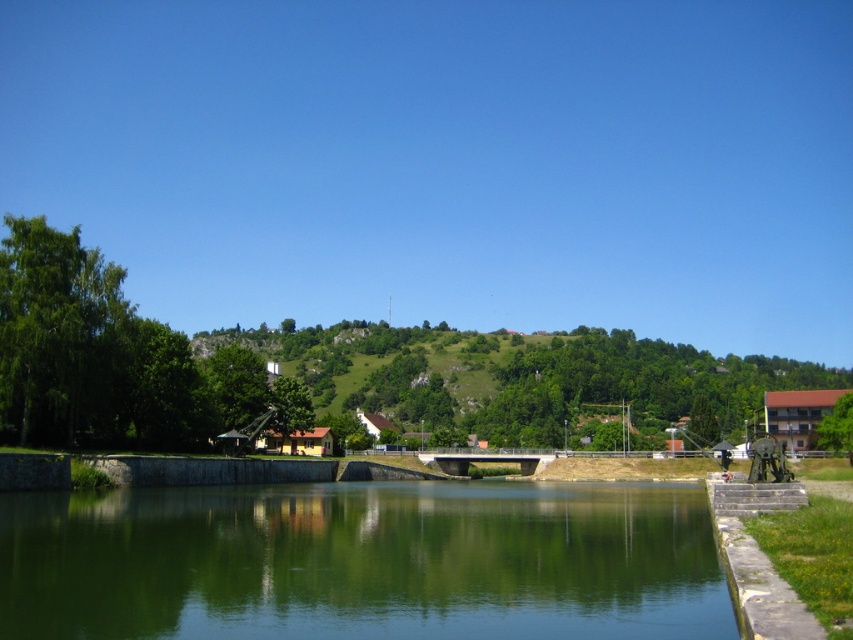
Looking at this image, you are standing at the origin point of the coordinate system. You want to reach the green smooth water at center. In which direction should you move?

The green smooth water at center is located at coordinate point (x=363, y=563). Since the x coordinate is higher than 0.5, it is to the right of the center. The y coordinate is 0.426, which is below the center point. Therefore, you should move to the right and slightly downward to reach the green smooth water at center.

You are standing on the embankment and want to walk from the green grassy hillside at center to the green smooth water at center. Which direction should you move to get closer to the water?

The green smooth water at center is thinner than the green grassy hillside at center, so you should move towards the direction where the area narrows to reach the water.

You are planning to take a photo of the green smooth water at center and the green grassy hillside at center. Which one should you focus on if you want to capture the larger area in your photo?

You should focus on the green grassy hillside at center because it occupies more space than the green smooth water at center according to the description.